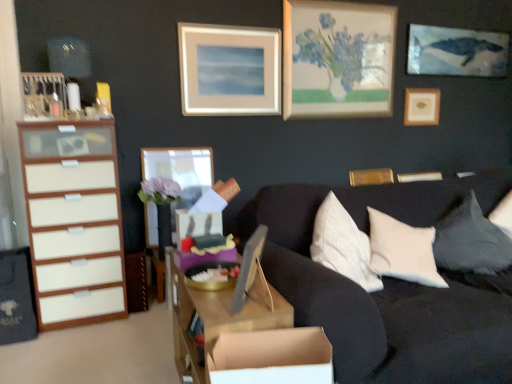
At what (x,y) coordinates should I click in order to perform the action: click on free point above matte wooden picture frame at upper center, placed as the second picture frame when sorted from left to right (from a real-world perspective). Please return your answer as a coordinate pair (x, y). This screenshot has height=384, width=512. Looking at the image, I should click on (230, 28).